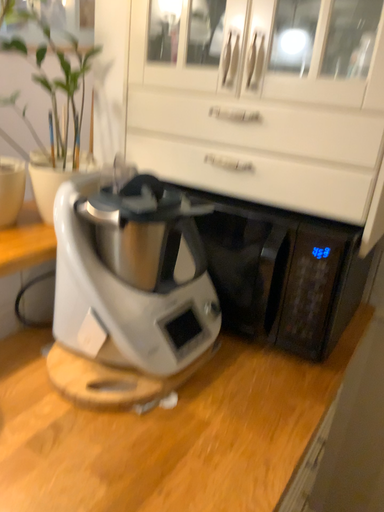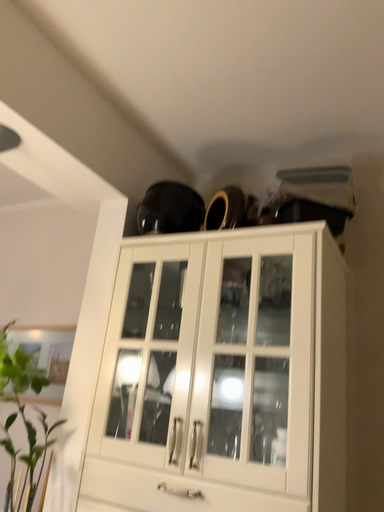
Question: Which way did the camera rotate in the video?

Choices:
 (A) rotated downward
 (B) rotated upward

Answer: (B)